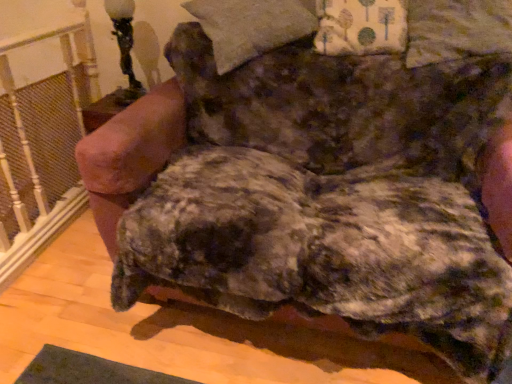
Question: Is fluffy beige pillow at upper center, which is the 2th pillow from right to left, in front of or behind black glass table lamp at upper left in the image?

Choices:
 (A) front
 (B) behind

Answer: (A)

Question: Considering the positions of point (312, 4) and point (125, 97), is point (312, 4) closer or farther from the camera than point (125, 97)?

Choices:
 (A) farther
 (B) closer

Answer: (B)

Question: Estimate the real-world distances between objects in this image. Which object is closer to the white painted wood at left?

Choices:
 (A) fluffy beige pillow at upper center, which is the 2th pillow from right to left
 (B) floral fabric pillow at upper right, arranged as the 1th pillow when viewed from the right
 (C) black glass table lamp at upper left
 (D) fluffy brown dog at center

Answer: (C)

Question: Which object is positioned farthest from the floral fabric pillow at upper right, the second pillow when ordered from left to right?

Choices:
 (A) black glass table lamp at upper left
 (B) white painted wood at left
 (C) fluffy beige pillow at upper center, which is the 2th pillow from right to left
 (D) fluffy brown dog at center

Answer: (B)